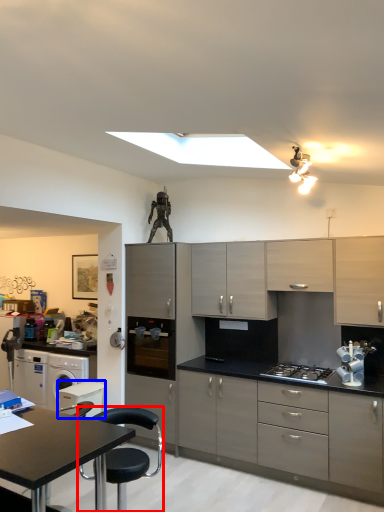
Question: Which of the following is the closest to the observer, chair (highlighted by a red box) or appliance (highlighted by a blue box)?

Choices:
 (A) chair
 (B) appliance

Answer: (A)